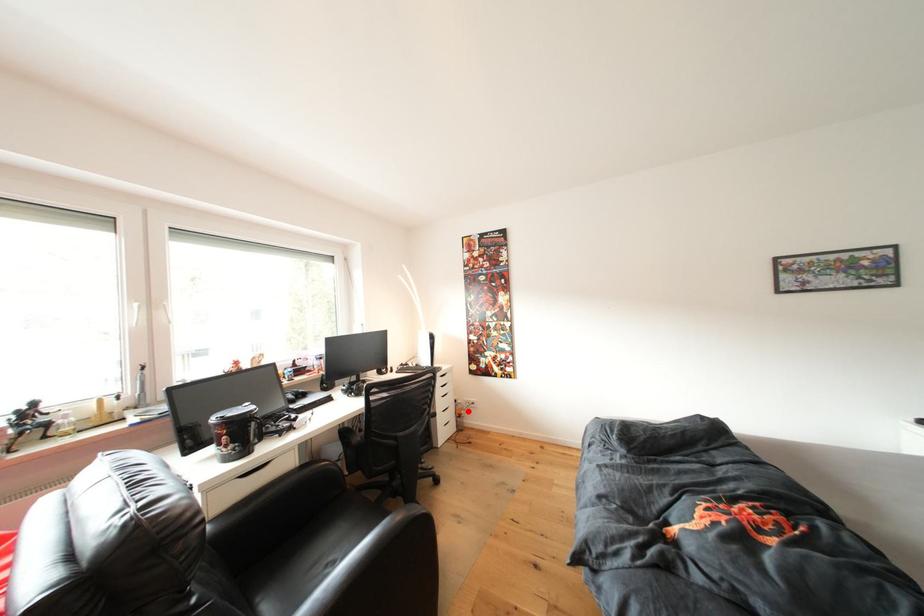
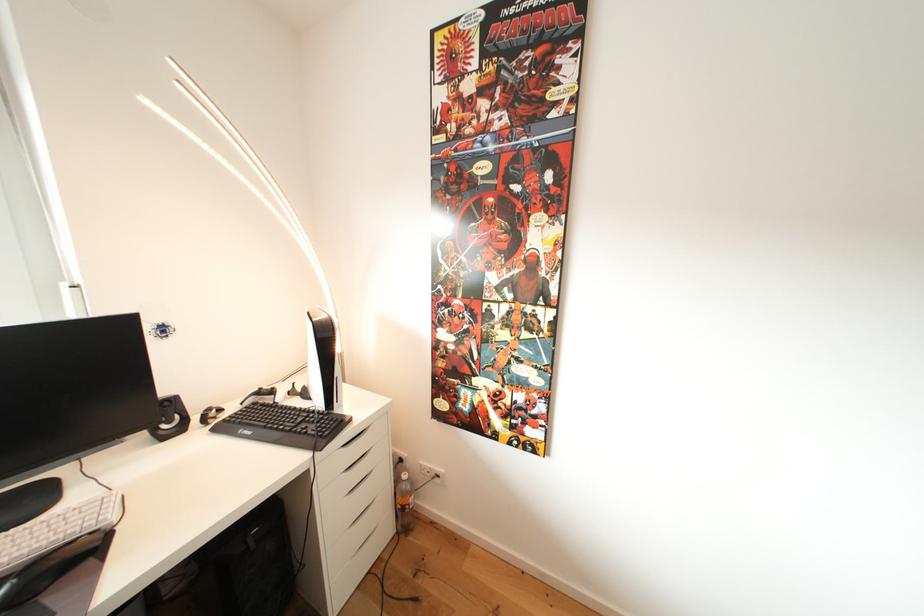
The point at the highlighted location is marked in the first image. Where is the corresponding point in the second image?

(412, 492)